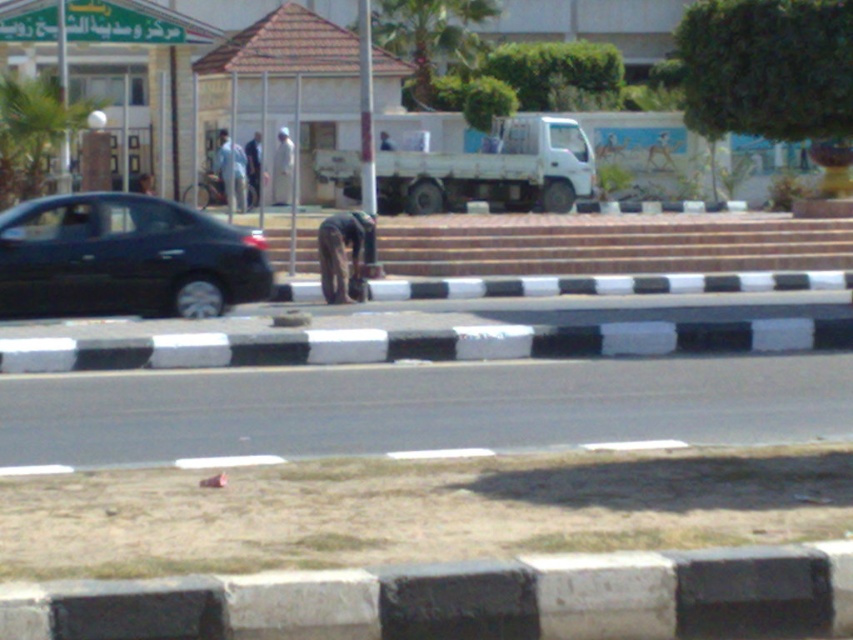
You are standing at the intersection and want to locate the green leafy palm tree at upper center. According to the scene description, where exactly is it positioned?

The green leafy palm tree at upper center is positioned at point (431, 38).

You are a pedestrian standing on the sidewalk and want to cross the street to reach the green leafy palm tree at upper center and the light beige fabric at center. Which object will you encounter first when you cross the street?

The light beige fabric at center will be encountered first because the green leafy palm tree at upper center is positioned to the right of the light beige fabric at center, meaning the light beige fabric is closer to the sidewalk where the pedestrian is standing.